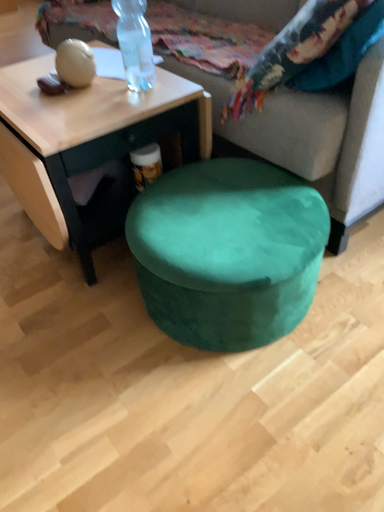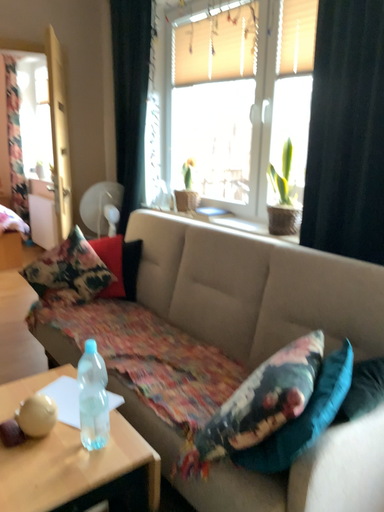
Question: How did the camera likely rotate when shooting the video?

Choices:
 (A) rotated downward
 (B) rotated upward

Answer: (B)